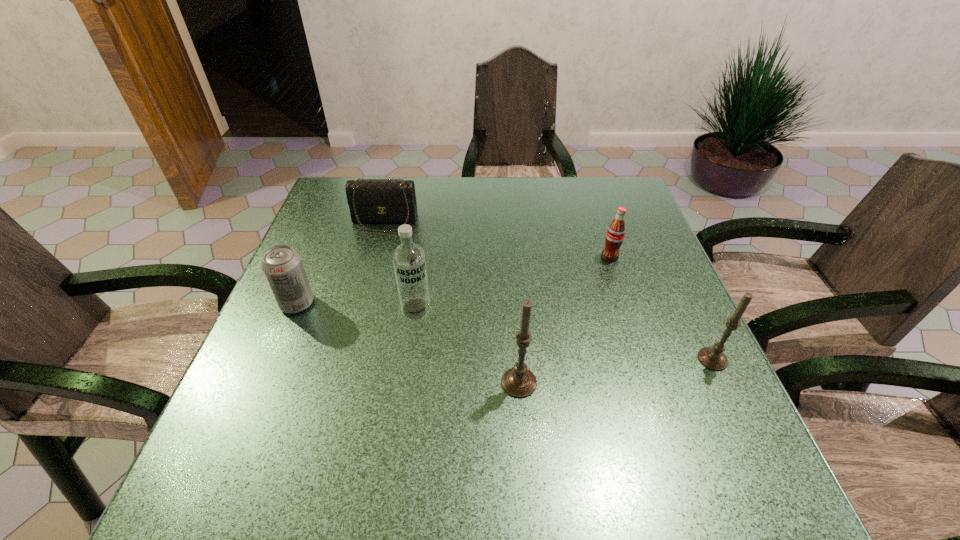
Locate an element on the screen. free point between the third object from left to right and the left candle is located at coordinates (x=468, y=346).

Image resolution: width=960 pixels, height=540 pixels. I want to click on free spot between the right soda can and the farthest object, so click(497, 239).

Find the location of a particular element. The image size is (960, 540). empty space that is in between the third object from left to right and the fifth object from left to right is located at coordinates (513, 283).

The width and height of the screenshot is (960, 540). What are the coordinates of `vacant space that's between the leftmost object and the left candle` in the screenshot? It's located at (408, 343).

Locate an element on the screen. This screenshot has width=960, height=540. free space between the fourth object from left to right and the second object from left to right is located at coordinates (452, 302).

The image size is (960, 540). What are the coordinates of `vacant space that is in between the third object from left to right and the shorter candle` in the screenshot? It's located at (564, 334).

Identify the location of object that is the second nearest to the fifth object from left to right. The height and width of the screenshot is (540, 960). click(519, 382).

Select which object is the closest to the leftmost object. Please provide its 2D coordinates. Your answer should be formatted as a tuple, i.e. [(x, y)], where the tuple contains the x and y coordinates of a point satisfying the conditions above.

[(409, 260)]

This screenshot has height=540, width=960. Find the location of `free space that satisfies the following two spatial constraints: 1. on the front flap of the clutch bag; 2. on the right side of the right candle`. free space that satisfies the following two spatial constraints: 1. on the front flap of the clutch bag; 2. on the right side of the right candle is located at coordinates (348, 359).

What are the coordinates of `free location that satisfies the following two spatial constraints: 1. on the front label of the shorter candle; 2. on the left side of the vodka` in the screenshot? It's located at (409, 359).